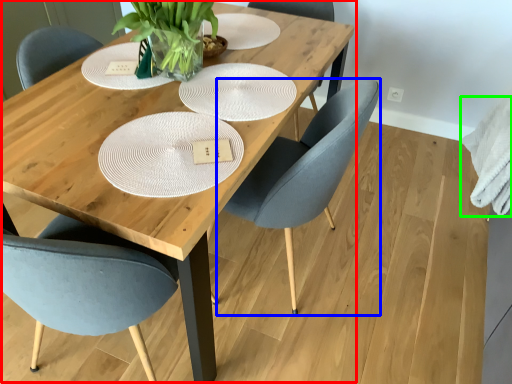
Question: Estimate the real-world distances between objects in this image. Which object is closer to table (highlighted by a red box), chair (highlighted by a blue box) or cloth (highlighted by a green box)?

Choices:
 (A) chair
 (B) cloth

Answer: (A)